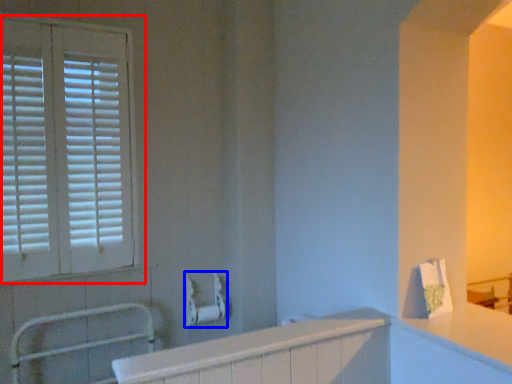
Question: Which point is further to the camera, window (highlighted by a red box) or towel bar (highlighted by a blue box)?

Choices:
 (A) window
 (B) towel bar

Answer: (B)